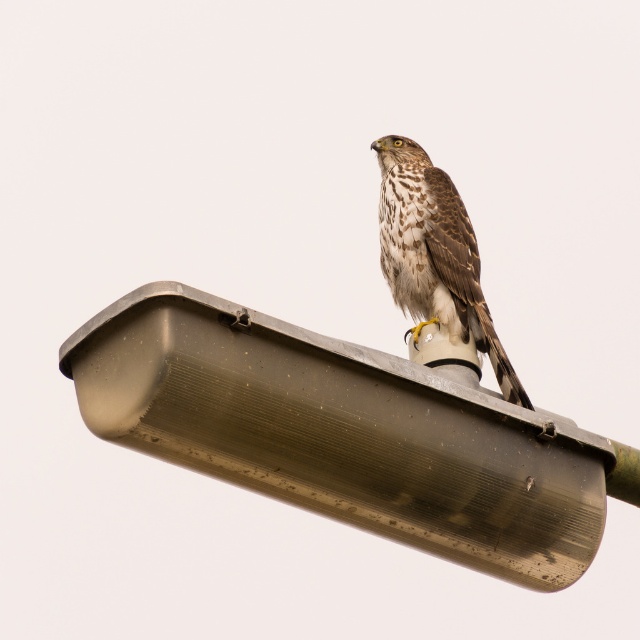
Question: Does metallic gray lamp post at upper center have a greater width compared to brown speckled feathers at upper center?

Choices:
 (A) no
 (B) yes

Answer: (B)

Question: Which object is farther from the camera taking this photo?

Choices:
 (A) brown speckled feathers at upper center
 (B) metallic gray lamp post at upper center

Answer: (A)

Question: In this image, where is metallic gray lamp post at upper center located relative to brown speckled feathers at upper center?

Choices:
 (A) right
 (B) left

Answer: (B)

Question: Where is metallic gray lamp post at upper center located in relation to brown speckled feathers at upper center in the image?

Choices:
 (A) above
 (B) below

Answer: (B)

Question: Which point is closer to the camera?

Choices:
 (A) metallic gray lamp post at upper center
 (B) brown speckled feathers at upper center

Answer: (A)

Question: Which of the following is the farthest from the observer?

Choices:
 (A) (573, 564)
 (B) (436, 300)

Answer: (B)